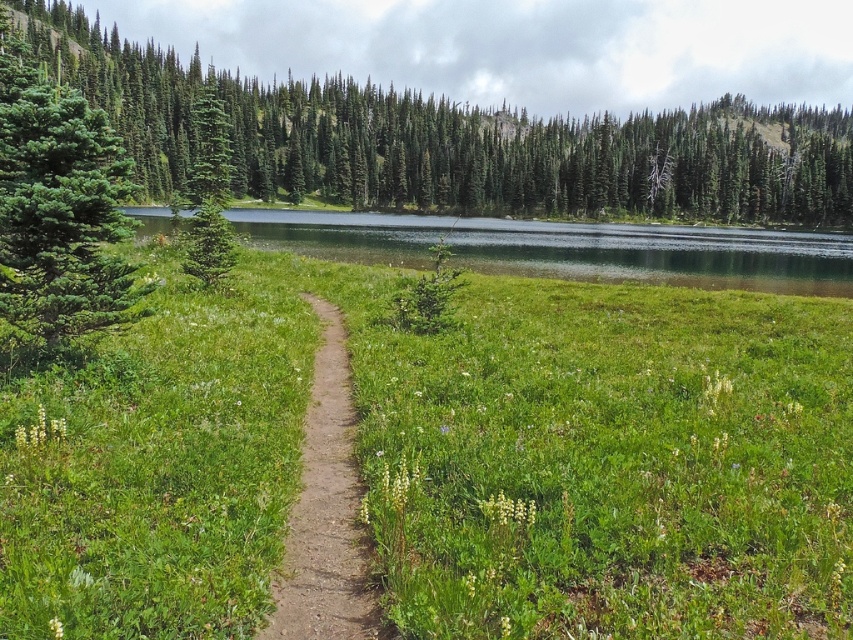
You are planning to take a photo of the green grassy lake at center and the green matte tree at left. Which object should you focus on first if you want to capture both in a single frame without moving the camera?

You should focus on the green grassy lake at center first because it is located below the green matte tree at left, so adjusting the camera to include both would require ensuring the tree is in the upper part of the frame and the lake is positioned lower.

You are standing on the dirt path and want to walk towards the green grassy lake at center and the green matte tree at left. Which object will you reach first?

You will reach the green grassy lake at center first because it is closer to you than the green matte tree at left, which is further away.

You are planning a photography session and want to capture both the green matte tree at left and the dirt path at center in your frame. Given that your camera can only focus on objects within a 30 cm height range, will both objects be in focus if you position the camera at ground level?

The green matte tree at left is taller than the dirt path at center. Since the camera can focus on objects within a 30 cm height range and the tree is significantly taller, the height difference between them might exceed 30 cm. Therefore, both objects may not be in focus simultaneously.